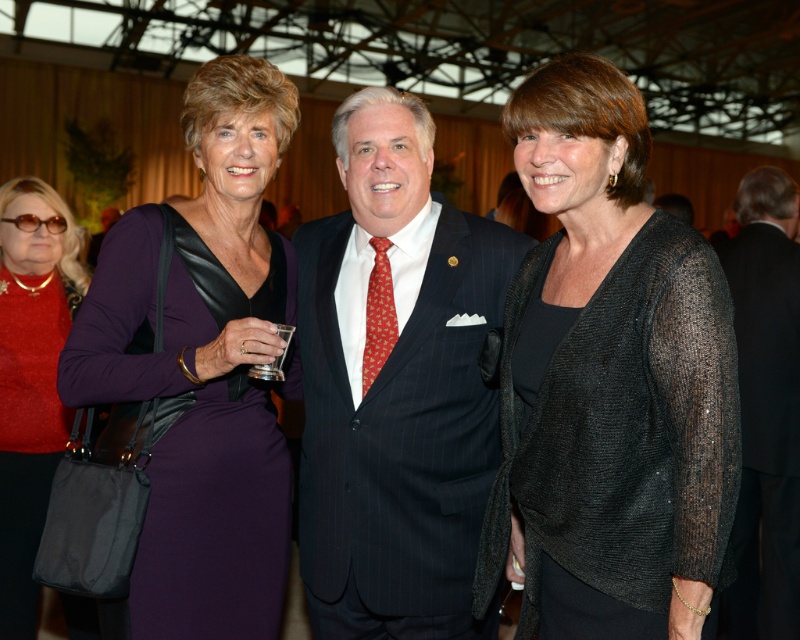
What is the 2D coordinate of the shiny red sweater at upper left?

The shiny red sweater at upper left is located at the 2D coordinate point of (30, 378).

You are at the event and want to locate the purple satin dress at center. According to the coordinates provided, where should you look?

The purple satin dress at center is located at point 0.572 on the x axis and 0.255 on the y axis.

In the scene, there are a purple satin dress at center and a shiny red sweater at upper left. Which one is positioned to the right side of the other?

The purple satin dress at center is to the right of the shiny red sweater at upper left.